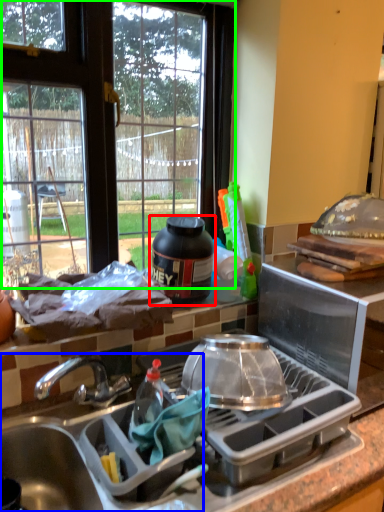
Question: Based on their relative distances, which object is farther from kitchen appliance (highlighted by a red box)? Choose from sink (highlighted by a blue box) and window (highlighted by a green box).

Choices:
 (A) sink
 (B) window

Answer: (B)